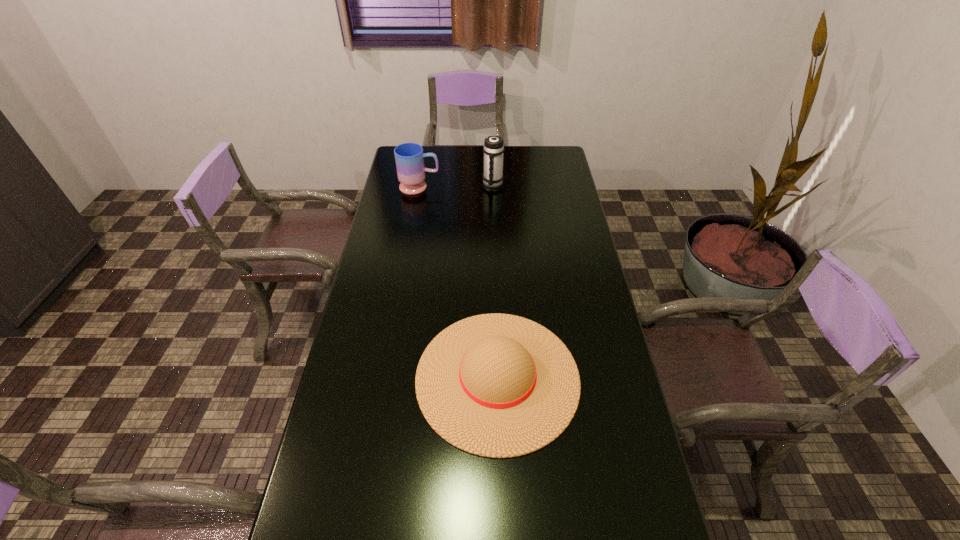
In order to click on free location at the left edge in this screenshot , I will do `click(394, 278)`.

In the image, there is a desktop. Where is `vacant space at the right edge`? vacant space at the right edge is located at coordinates (612, 359).

Identify the location of free space that is in between the thermos bottle and the second shortest object. This screenshot has width=960, height=540. (456, 185).

At what (x,y) coordinates should I click in order to perform the action: click on vacant point located between the mug and the thermos bottle. Please return your answer as a coordinate pair (x, y). The image size is (960, 540). Looking at the image, I should click on (456, 185).

This screenshot has width=960, height=540. I want to click on free spot between the mug and the thermos bottle, so click(456, 185).

At what (x,y) coordinates should I click in order to perform the action: click on vacant area that lies between the shortest object and the second shortest object. Please return your answer as a coordinate pair (x, y). The image size is (960, 540). Looking at the image, I should click on (459, 282).

The width and height of the screenshot is (960, 540). I want to click on free area in between the nearest object and the second shortest object, so click(x=459, y=282).

You are a GUI agent. You are given a task and a screenshot of the screen. Output one action in this format:
    pyautogui.click(x=<x>, y=<y>)
    Task: Click on the second closest object relative to the mug
    The width and height of the screenshot is (960, 540).
    Given the screenshot: What is the action you would take?
    pyautogui.click(x=496, y=385)

Identify which object is located as the nearest to the nearest object. Please provide its 2D coordinates. Your answer should be formatted as a tuple, i.e. [(x, y)], where the tuple contains the x and y coordinates of a point satisfying the conditions above.

[(409, 157)]

Identify the location of blank space that satisfies the following two spatial constraints: 1. on the side of the shortest object with the handle; 2. on the right side of the mug. tap(387, 377).